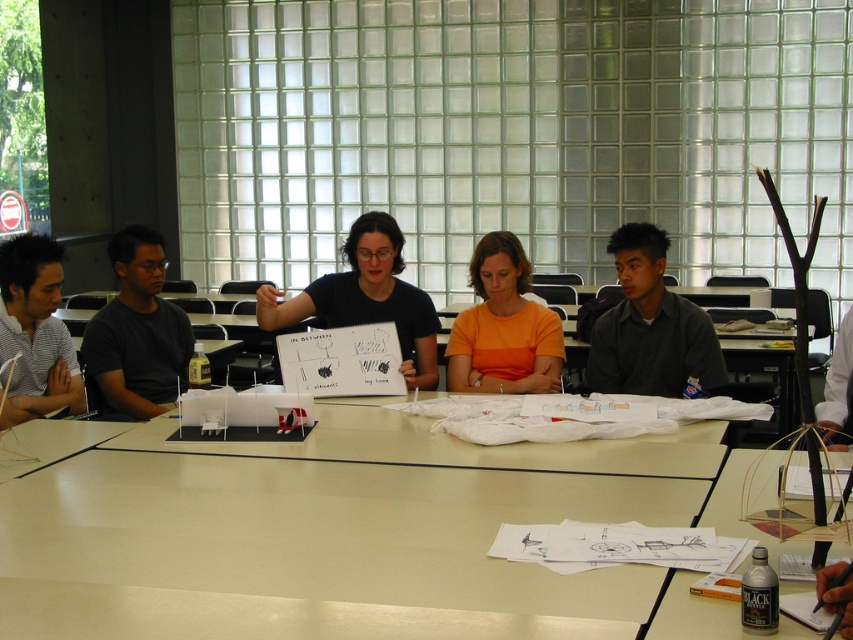
Consider the image. How much distance is there between dark gray shirt at center and matte black shirt at center?

83.59 centimeters

Does point (628, 369) lie in front of point (369, 260)?

No, it is not.

At what (x,y) coordinates should I click in order to perform the action: click on dark gray shirt at center. Please return your answer as a coordinate pair (x, y). The image size is (853, 640). Looking at the image, I should click on (650, 326).

Between dark gray shirt at center and matte black bottle at lower right, which one is positioned lower?

Positioned lower is matte black bottle at lower right.

Between point (657, 324) and point (668, 637), which one is positioned in front?

Positioned in front is point (668, 637).

Is point (706, 374) farther from camera compared to point (729, 616)?

That is True.

Locate an element on the screen. dark gray shirt at center is located at coordinates (650, 326).

Is matte black shirt at center to the left of matte black bottle at lower right from the viewer's perspective?

Correct, you'll find matte black shirt at center to the left of matte black bottle at lower right.

Is point (354, 305) positioned in front of point (787, 547)?

No, (354, 305) is further to viewer.

Is point (347, 282) less distant than point (811, 637)?

No, (347, 282) is further to viewer.

You are a GUI agent. You are given a task and a screenshot of the screen. Output one action in this format:
    pyautogui.click(x=<x>, y=<y>)
    Task: Click on the matte black shirt at center
    Image resolution: width=853 pixels, height=640 pixels.
    Given the screenshot: What is the action you would take?
    pyautogui.click(x=366, y=298)